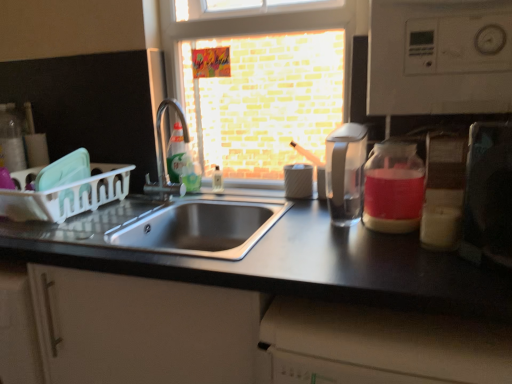
The width and height of the screenshot is (512, 384). I want to click on metallic stainless steel sink at center, so click(259, 307).

Where is `metallic silver toaster at right`? The image size is (512, 384). metallic silver toaster at right is located at coordinates (488, 194).

Image resolution: width=512 pixels, height=384 pixels. In order to click on pink translucent glass jar at right in this screenshot , I will do `click(393, 187)`.

The image size is (512, 384). What do you see at coordinates (190, 172) in the screenshot?
I see `translucent green liquid at sink left, the 1th bottle in the right-to-left sequence` at bounding box center [190, 172].

In order to click on translucent green liquid at sink left, the 1th bottle in the right-to-left sequence in this screenshot , I will do `click(190, 172)`.

What is the approximate height of brick wall at center?

It is 71.86 centimeters.

Locate an element on the screen. This screenshot has width=512, height=384. white plastic dish rack at left is located at coordinates (65, 194).

Measure the distance between transparent plastic coffee machine at center and camera.

They are 1.05 meters apart.

Image resolution: width=512 pixels, height=384 pixels. Identify the location of metallic stainless steel sink at center. (259, 307).

Considering the relative positions of satin nickel faucet at sink left and pink translucent glass jar at right in the image provided, is satin nickel faucet at sink left to the left or to the right of pink translucent glass jar at right?

Clearly, satin nickel faucet at sink left is on the left of pink translucent glass jar at right in the image.

Is satin nickel faucet at sink left facing away from pink translucent glass jar at right?

satin nickel faucet at sink left is not turned away from pink translucent glass jar at right.

Considering the relative sizes of satin nickel faucet at sink left and pink translucent glass jar at right in the image provided, is satin nickel faucet at sink left bigger than pink translucent glass jar at right?

Yes.

Which of these two, satin nickel faucet at sink left or pink translucent glass jar at right, stands taller?

Standing taller between the two is satin nickel faucet at sink left.

Who is shorter, green plastic bottle at sink, positioned as the 1th bottle in left-to-right order, or metallic stainless steel sink at center?

With less height is green plastic bottle at sink, positioned as the 1th bottle in left-to-right order.

From a real-world perspective, who is located lower, green plastic bottle at sink, positioned as the 1th bottle in left-to-right order, or metallic stainless steel sink at center?

In real-world perspective, metallic stainless steel sink at center is lower.

Is green plastic bottle at sink, positioned as the 2th bottle in right-to-left order, thinner than metallic stainless steel sink at center?

Indeed, green plastic bottle at sink, positioned as the 2th bottle in right-to-left order, has a lesser width compared to metallic stainless steel sink at center.

Is transparent plastic coffee machine at center thinner than translucent green liquid at sink left, the 2th bottle positioned from the left?

Incorrect, the width of transparent plastic coffee machine at center is not less than that of translucent green liquid at sink left, the 2th bottle positioned from the left.

Based on the photo, from a real-world perspective, is transparent plastic coffee machine at center positioned under translucent green liquid at sink left, the 2th bottle positioned from the left, based on gravity?

Incorrect, from a real-world perspective, transparent plastic coffee machine at center is higher than translucent green liquid at sink left, the 2th bottle positioned from the left.

Considering the sizes of objects transparent plastic coffee machine at center and translucent green liquid at sink left, the 2th bottle positioned from the left, in the image provided, who is bigger, transparent plastic coffee machine at center or translucent green liquid at sink left, the 2th bottle positioned from the left,?

transparent plastic coffee machine at center is bigger.

Where is `coffee machine on the right of translucent green liquid at sink left, the 1th bottle in the right-to-left sequence`? coffee machine on the right of translucent green liquid at sink left, the 1th bottle in the right-to-left sequence is located at coordinates 345,172.

Considering the sizes of objects pink translucent glass jar at right and green plastic bottle at sink, positioned as the 1th bottle in left-to-right order, in the image provided, who is bigger, pink translucent glass jar at right or green plastic bottle at sink, positioned as the 1th bottle in left-to-right order,?

With larger size is pink translucent glass jar at right.

Which object is more forward, pink translucent glass jar at right or green plastic bottle at sink, positioned as the 1th bottle in left-to-right order?

pink translucent glass jar at right is in front.

Consider the image. Considering the relative positions of pink translucent glass jar at right and green plastic bottle at sink, positioned as the 1th bottle in left-to-right order, in the image provided, is pink translucent glass jar at right to the left or to the right of green plastic bottle at sink, positioned as the 1th bottle in left-to-right order,?

In the image, pink translucent glass jar at right appears on the right side of green plastic bottle at sink, positioned as the 1th bottle in left-to-right order.

From a real-world perspective, who is located higher, pink translucent glass jar at right or green plastic bottle at sink, positioned as the 2th bottle in right-to-left order?

green plastic bottle at sink, positioned as the 2th bottle in right-to-left order, is physically above.

From the picture: Is metallic silver toaster at right located within green plastic bottle at sink, positioned as the 2th bottle in right-to-left order?

Actually, metallic silver toaster at right is outside green plastic bottle at sink, positioned as the 2th bottle in right-to-left order.

Consider the image. From the image's perspective, between green plastic bottle at sink, positioned as the 1th bottle in left-to-right order, and metallic silver toaster at right, which one is located above?

green plastic bottle at sink, positioned as the 1th bottle in left-to-right order, from the image's perspective.

Based on their sizes in the image, would you say green plastic bottle at sink, positioned as the 2th bottle in right-to-left order, is bigger or smaller than metallic silver toaster at right?

Considering their sizes, green plastic bottle at sink, positioned as the 2th bottle in right-to-left order, takes up less space than metallic silver toaster at right.

Which object is wider, green plastic bottle at sink, positioned as the 1th bottle in left-to-right order, or metallic silver toaster at right?

Wider between the two is metallic silver toaster at right.

Is translucent green liquid at sink left, the 1th bottle in the right-to-left sequence, taller than white plastic dish rack at left?

In fact, translucent green liquid at sink left, the 1th bottle in the right-to-left sequence, may be shorter than white plastic dish rack at left.

Can you tell me how much translucent green liquid at sink left, the 2th bottle positioned from the left, and white plastic dish rack at left differ in facing direction?

translucent green liquid at sink left, the 2th bottle positioned from the left, and white plastic dish rack at left are facing 0.000856 degrees away from each other.

This screenshot has height=384, width=512. What are the coordinates of `the 2nd bottle to the right of the white plastic dish rack at left, counting from the anchor's position` in the screenshot? It's located at (190, 172).

Considering the relative positions of translucent green liquid at sink left, the 2th bottle positioned from the left, and white plastic dish rack at left in the image provided, is translucent green liquid at sink left, the 2th bottle positioned from the left, to the left of white plastic dish rack at left from the viewer's perspective?

Incorrect, translucent green liquid at sink left, the 2th bottle positioned from the left, is not on the left side of white plastic dish rack at left.

Is the surface of brick wall at center in direct contact with satin nickel faucet at sink left?

No, brick wall at center is not next to satin nickel faucet at sink left.

From the image's perspective, is brick wall at center beneath satin nickel faucet at sink left?

No.

This screenshot has height=384, width=512. In order to click on tap behind the pink translucent glass jar at right in this screenshot , I will do `click(165, 157)`.

I want to click on countertop that is in front of the green plastic bottle at sink, positioned as the 1th bottle in left-to-right order, so click(x=259, y=307).

Estimate the real-world distances between objects in this image. Which object is closer to pink translucent glass jar at right, brick wall at center or satin nickel faucet at sink left?

Based on the image, brick wall at center appears to be nearer to pink translucent glass jar at right.

Which object lies nearer to the anchor point brick wall at center, pink translucent glass jar at right or transparent plastic coffee machine at center?

Among the two, transparent plastic coffee machine at center is located nearer to brick wall at center.

Estimate the real-world distances between objects in this image. Which object is further from brick wall at center, metallic stainless steel sink at center or satin nickel faucet at sink left?

metallic stainless steel sink at center.

From the image, which object appears to be nearer to satin nickel faucet at sink left, pink translucent glass jar at right or metallic stainless steel sink at center?

metallic stainless steel sink at center is positioned closer to the anchor satin nickel faucet at sink left.

Estimate the real-world distances between objects in this image. Which object is closer to pink translucent glass jar at right, satin nickel faucet at sink left or brick wall at center?

brick wall at center is positioned closer to the anchor pink translucent glass jar at right.

Based on their spatial positions, is metallic silver toaster at right or metallic stainless steel sink at center closer to brick wall at center?

metallic stainless steel sink at center lies closer to brick wall at center than the other object.

Estimate the real-world distances between objects in this image. Which object is closer to brick wall at center, translucent green liquid at sink left, the 2th bottle positioned from the left, or transparent plastic coffee machine at center?

translucent green liquid at sink left, the 2th bottle positioned from the left, lies closer to brick wall at center than the other object.

Estimate the real-world distances between objects in this image. Which object is further from brick wall at center, green plastic bottle at sink, positioned as the 2th bottle in right-to-left order, or translucent green liquid at sink left, the 1th bottle in the right-to-left sequence?

translucent green liquid at sink left, the 1th bottle in the right-to-left sequence, lies further to brick wall at center than the other object.

The width and height of the screenshot is (512, 384). Find the location of `coffee machine between brick wall at center and metallic stainless steel sink at center in the up-down direction`. coffee machine between brick wall at center and metallic stainless steel sink at center in the up-down direction is located at coordinates (345, 172).

What are the coordinates of `glass jar between white plastic dish rack at left and metallic silver toaster at right in the horizontal direction` in the screenshot? It's located at (393, 187).

Locate an element on the screen. This screenshot has width=512, height=384. window between satin nickel faucet at sink left and pink translucent glass jar at right in the horizontal direction is located at coordinates (263, 78).

The image size is (512, 384). In order to click on coffee machine between satin nickel faucet at sink left and metallic stainless steel sink at center in the up-down direction in this screenshot , I will do `click(345, 172)`.